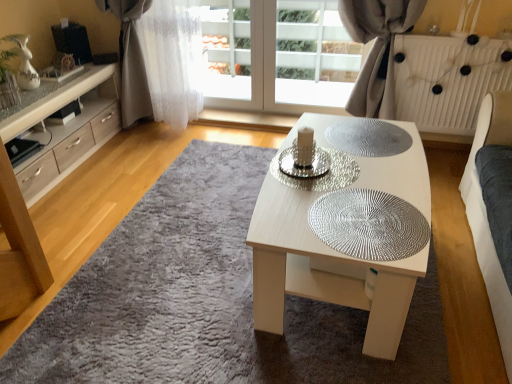
Locate an element on the screen. free space below silver textured glass plate at center, the first glass plate when ordered from front to back (from a real-world perspective) is located at coordinates (362, 219).